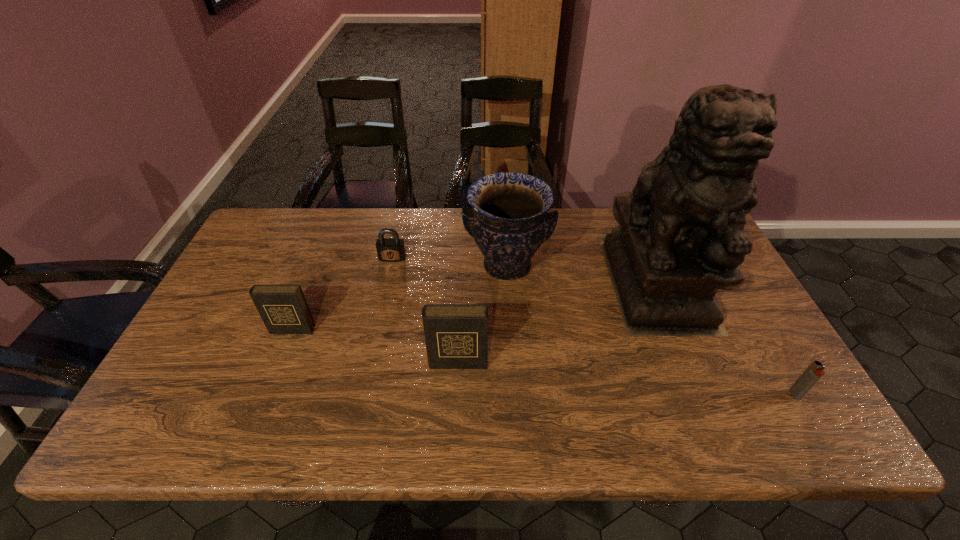
Locate an element on the screen. vacant space situated 0.130m on the front cover of the leftmost object is located at coordinates (273, 377).

The width and height of the screenshot is (960, 540). Find the location of `vacant space positioned 0.110m on the front-facing side of the sculpture`. vacant space positioned 0.110m on the front-facing side of the sculpture is located at coordinates (694, 374).

Identify the location of vacant position located on the front of the padlock near the keyhole. The width and height of the screenshot is (960, 540). (375, 339).

Identify the location of free space located on the front handle of the pottery. The image size is (960, 540). (510, 309).

Find the location of a particular element. The width and height of the screenshot is (960, 540). vacant space located 0.370m on the left of the igniter is located at coordinates (631, 395).

Where is `sculpture that is at the far edge`? The height and width of the screenshot is (540, 960). sculpture that is at the far edge is located at coordinates (680, 237).

In order to click on padlock at the far edge in this screenshot , I will do `click(388, 249)`.

At what (x,y) coordinates should I click in order to perform the action: click on pottery present at the far edge. Please return your answer as a coordinate pair (x, y). The height and width of the screenshot is (540, 960). Looking at the image, I should click on (509, 221).

Identify the location of object that is at the near edge. The height and width of the screenshot is (540, 960). (814, 372).

This screenshot has height=540, width=960. Identify the location of sculpture that is at the right edge. (680, 237).